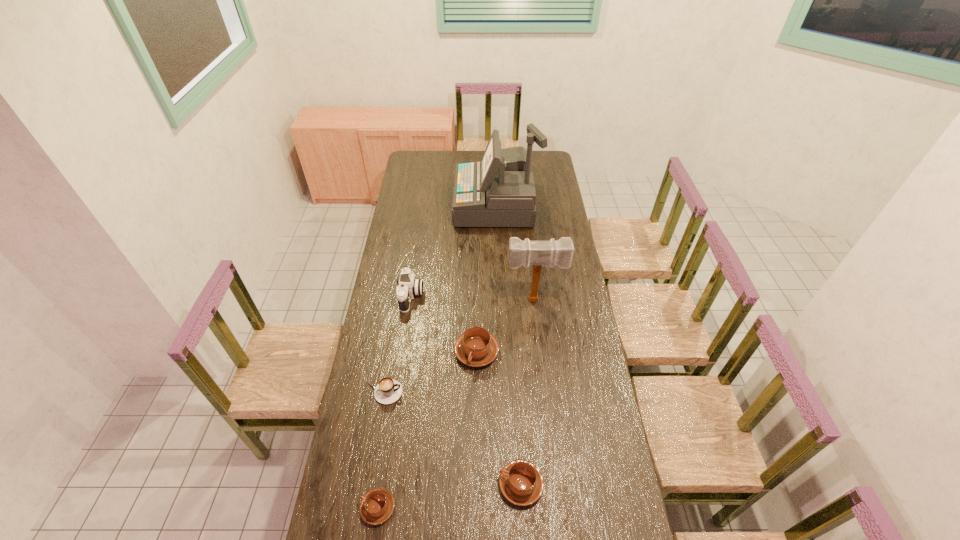
The image size is (960, 540). I want to click on empty space that is in between the tallest cappuccino and the leftmost brown cappuccino, so click(427, 429).

Identify the location of empty space between the wood mallet and the third shortest object. This screenshot has height=540, width=960. 528,392.

Find the location of `vacant area between the mallet and the tallest cappuccino`. vacant area between the mallet and the tallest cappuccino is located at coordinates (506, 326).

I want to click on free spot between the farthest object and the second biggest brown cappuccino, so click(508, 345).

What are the coordinates of `free spot between the cash register and the fifth shortest object` in the screenshot? It's located at (453, 251).

In order to click on vacant space in between the cash register and the tallest cappuccino in this screenshot , I will do `click(486, 278)`.

At what (x,y) coordinates should I click in order to perform the action: click on free space between the fourth tallest object and the cash register. Please return your answer as a coordinate pair (x, y). The image size is (960, 540). Looking at the image, I should click on (486, 278).

Where is `free spot between the smallest brown cappuccino and the second biggest brown cappuccino`? free spot between the smallest brown cappuccino and the second biggest brown cappuccino is located at coordinates (449, 496).

Find the location of a particular element. This screenshot has height=540, width=960. free area in between the tallest object and the black camera is located at coordinates (453, 251).

Locate an element on the screen. object that is the sixth closest to the fifth farthest object is located at coordinates (499, 191).